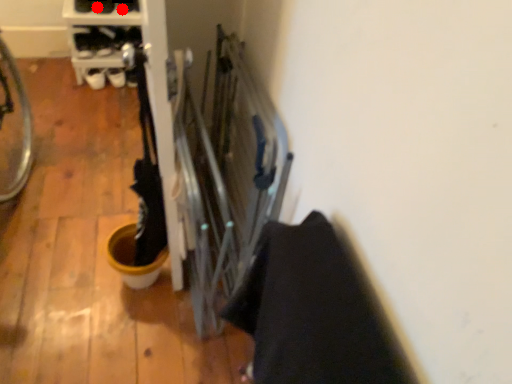
Question: Two points are circled on the image, labeled by A and B beside each circle. Which point is closer to the camera?

Choices:
 (A) A is closer
 (B) B is closer

Answer: (B)